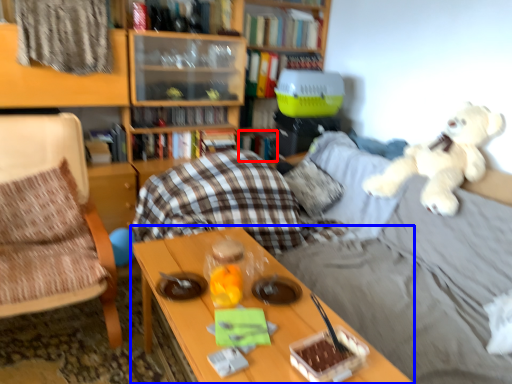
Question: Which object appears farthest to the camera in this image, book (highlighted by a red box) or table (highlighted by a blue box)?

Choices:
 (A) book
 (B) table

Answer: (A)